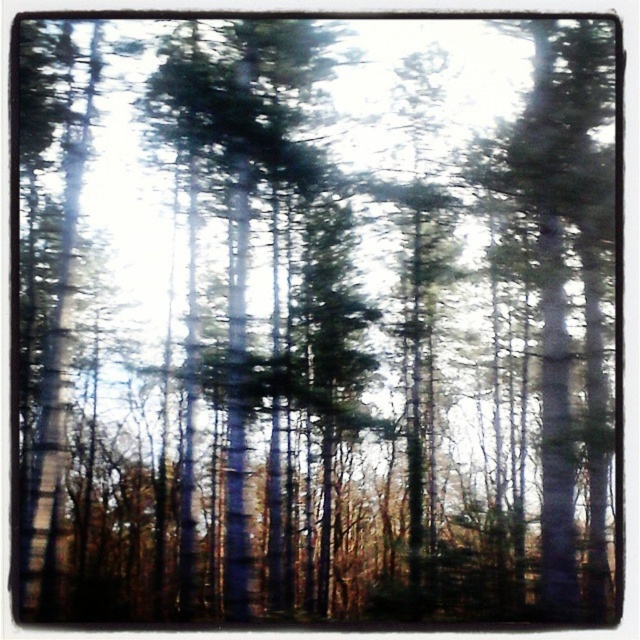
You are a hiker carrying a 1 meter long backpack. You want to walk between the green matte tree at center and the green matte tree at right. Can your backpack fit through the space between them without touching either tree?

The distance between the green matte tree at center and the green matte tree at right is 97.57 centimeters. Since your backpack is 1 meter long, it is slightly longer than the available space. Therefore, the backpack cannot fit through the space without touching the trees.

You are a hiker navigating through the dense forest depicted in the scene. You notice two trees ahead of you, the green matte tree at center and the green matte tree at right. Which tree appears closer to you based on their positions in the image?

The green matte tree at center is located above the green matte tree at right, so the green matte tree at right appears closer to you.

You are navigating through the forest and want to reach a hidden treasure located at point (568, 444). You are currently at point (310, 365). Since the forest is dense with tall trees, you need to know which point is closer to you to avoid getting lost. Which point is closer to your current position?

Point (568, 444) is closer to your current position because it is in front of point (310, 365).